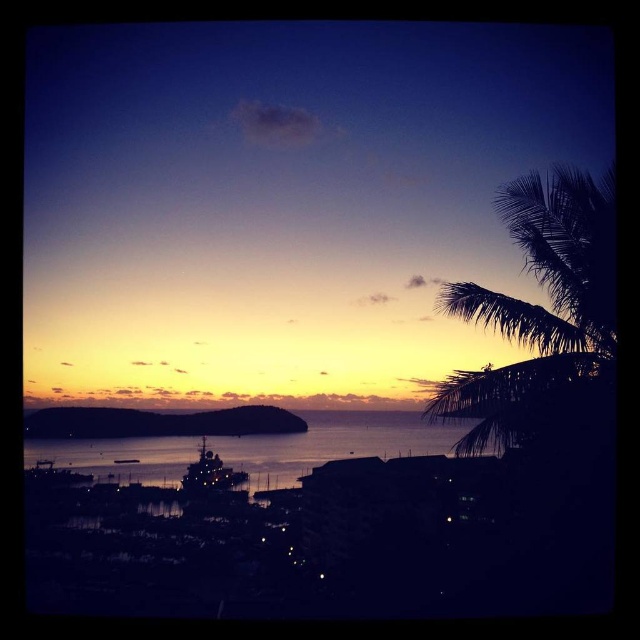
Consider the image. Can you confirm if glistening water at center is positioned to the right of shiny metallic boat at center?

Yes, glistening water at center is to the right of shiny metallic boat at center.

You are a GUI agent. You are given a task and a screenshot of the screen. Output one action in this format:
    pyautogui.click(x=<x>, y=<y>)
    Task: Click on the glistening water at center
    
    Given the screenshot: What is the action you would take?
    pyautogui.click(x=332, y=445)

Is silhouette leafy palm at right below shiny metallic boat at center?

Actually, silhouette leafy palm at right is above shiny metallic boat at center.

In the scene shown: Is silhouette leafy palm at right thinner than shiny metallic boat at center?

Incorrect, silhouette leafy palm at right's width is not less than shiny metallic boat at center's.

Image resolution: width=640 pixels, height=640 pixels. Describe the element at coordinates (544, 317) in the screenshot. I see `silhouette leafy palm at right` at that location.

Identify the location of silhouette leafy palm at right. (544, 317).

Does silhouette leafy palm at right appear over glistening water at center?

Correct, silhouette leafy palm at right is located above glistening water at center.

This screenshot has height=640, width=640. What are the coordinates of `silhouette leafy palm at right` in the screenshot? It's located at (544, 317).

Describe the element at coordinates (544, 317) in the screenshot. This screenshot has height=640, width=640. I see `silhouette leafy palm at right` at that location.

You are a GUI agent. You are given a task and a screenshot of the screen. Output one action in this format:
    pyautogui.click(x=<x>, y=<y>)
    Task: Click on the silhouette leafy palm at right
    The image size is (640, 640).
    Given the screenshot: What is the action you would take?
    pyautogui.click(x=544, y=317)